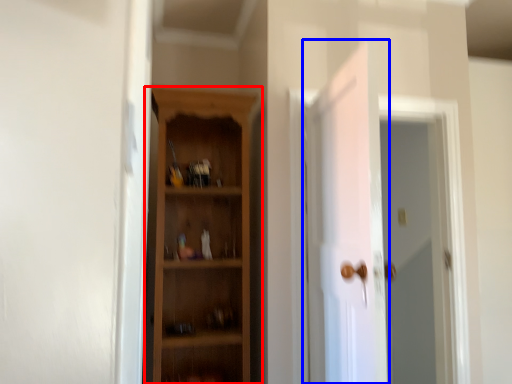
Question: Which object is closer to the camera taking this photo, cupboard (highlighted by a red box) or door (highlighted by a blue box)?

Choices:
 (A) cupboard
 (B) door

Answer: (B)